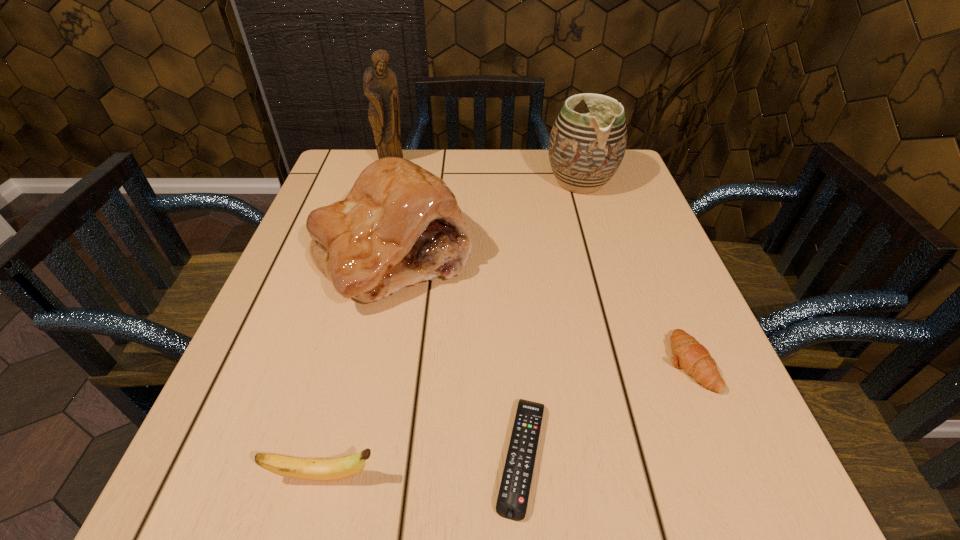
At what (x,y) coordinates should I click in order to perform the action: click on vacant space located on the filling side of the bread. Please return your answer as a coordinate pair (x, y). This screenshot has height=540, width=960. Looking at the image, I should click on (336, 522).

Identify the location of vacant area located at the stem of the fourth tallest object. This screenshot has width=960, height=540. (474, 476).

This screenshot has width=960, height=540. I want to click on vacant space situated on the back of the fifth tallest object, so click(625, 205).

Locate an element on the screen. The image size is (960, 540). vacant position located on the right of the remote control is located at coordinates (591, 456).

Locate an element on the screen. The height and width of the screenshot is (540, 960). figurine present at the far edge is located at coordinates (380, 86).

You are a GUI agent. You are given a task and a screenshot of the screen. Output one action in this format:
    pyautogui.click(x=<x>, y=<y>)
    Task: Click on the pottery present at the far edge
    The image size is (960, 540).
    Given the screenshot: What is the action you would take?
    pyautogui.click(x=585, y=150)

Identify the location of banana that is at the near edge. This screenshot has width=960, height=540. (332, 469).

This screenshot has height=540, width=960. I want to click on remote control that is at the near edge, so click(512, 501).

Identify the location of figurine located in the left edge section of the desktop. This screenshot has height=540, width=960. (380, 86).

Where is `bread at the left edge`? bread at the left edge is located at coordinates (399, 225).